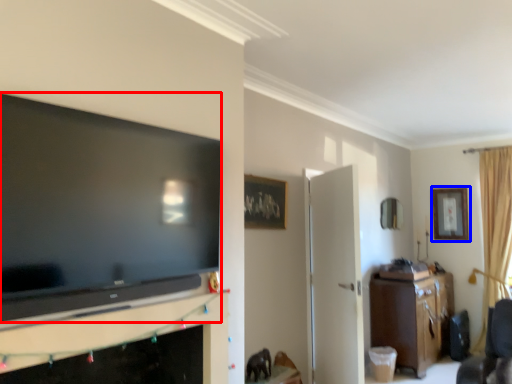
Question: Which object is closer to the camera taking this photo, television (highlighted by a red box) or picture frame (highlighted by a blue box)?

Choices:
 (A) television
 (B) picture frame

Answer: (A)